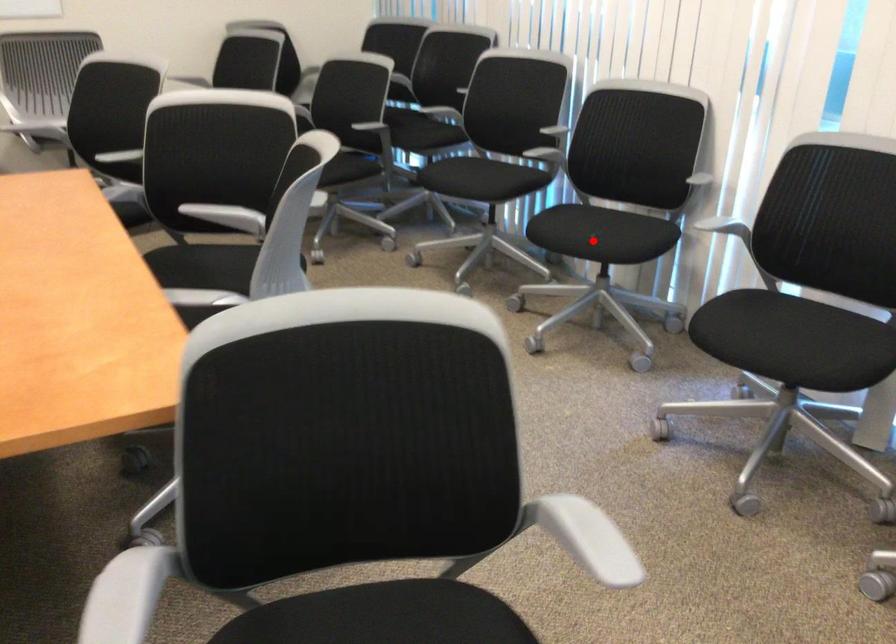
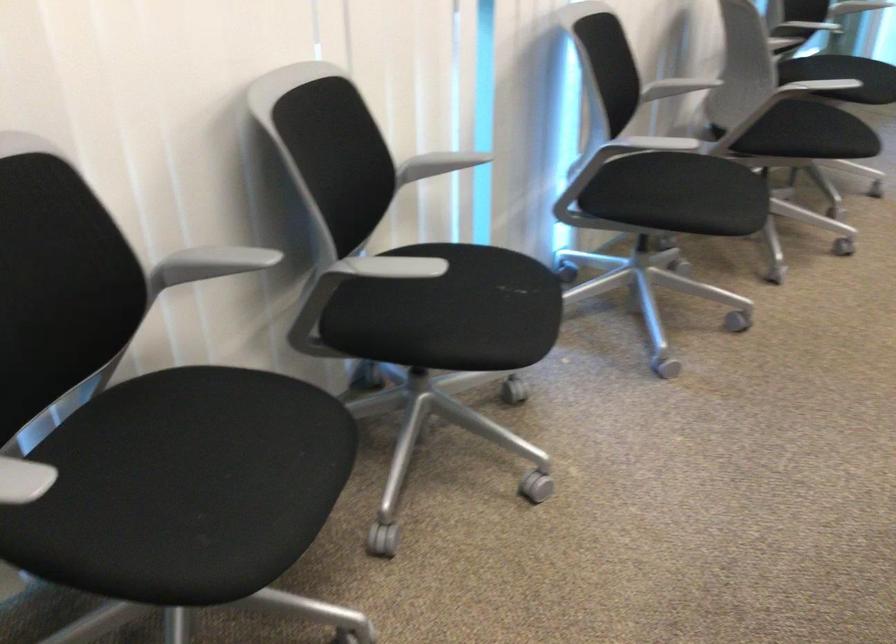
Question: I am providing you with two images of the same scene from different viewpoints. Image1 has a red point marked. In image2, the corresponding 3D location appears at what relative position? Reply with the corresponding letter.

Choices:
 (A) Closer
 (B) Farther

Answer: (A)